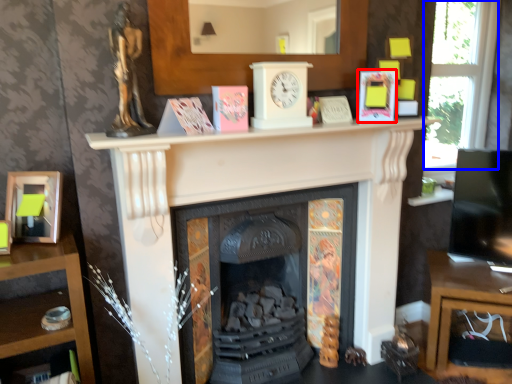
Question: Which object appears farthest to the camera in this image, paperback book (highlighted by a red box) or window (highlighted by a blue box)?

Choices:
 (A) paperback book
 (B) window

Answer: (B)